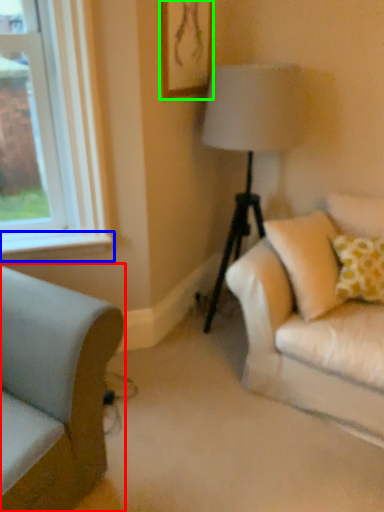
Question: Which is nearer to the studio couch (highlighted by a red box)? window sill (highlighted by a blue box) or picture frame (highlighted by a green box).

Choices:
 (A) window sill
 (B) picture frame

Answer: (A)